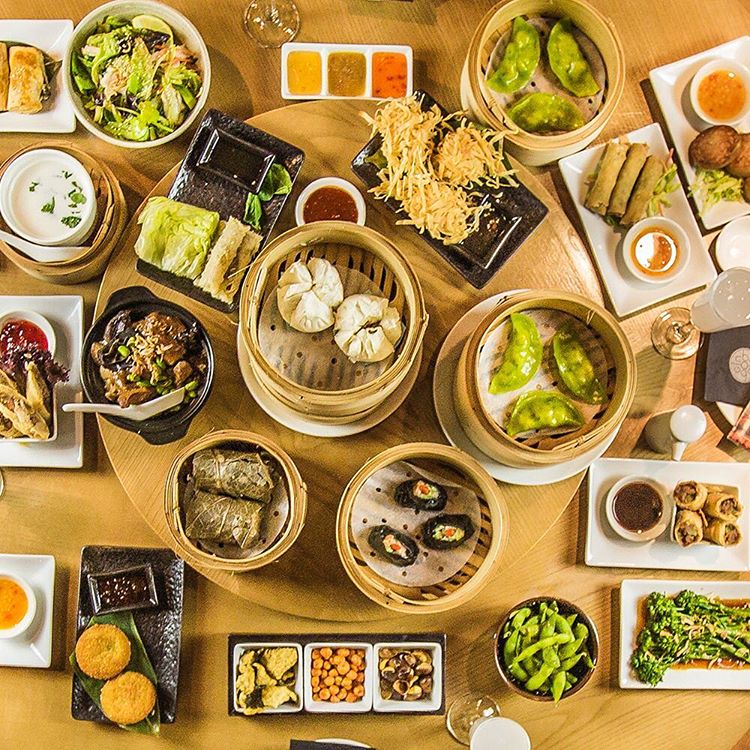
Where is `table surface`? Image resolution: width=750 pixels, height=750 pixels. table surface is located at coordinates (550, 566).